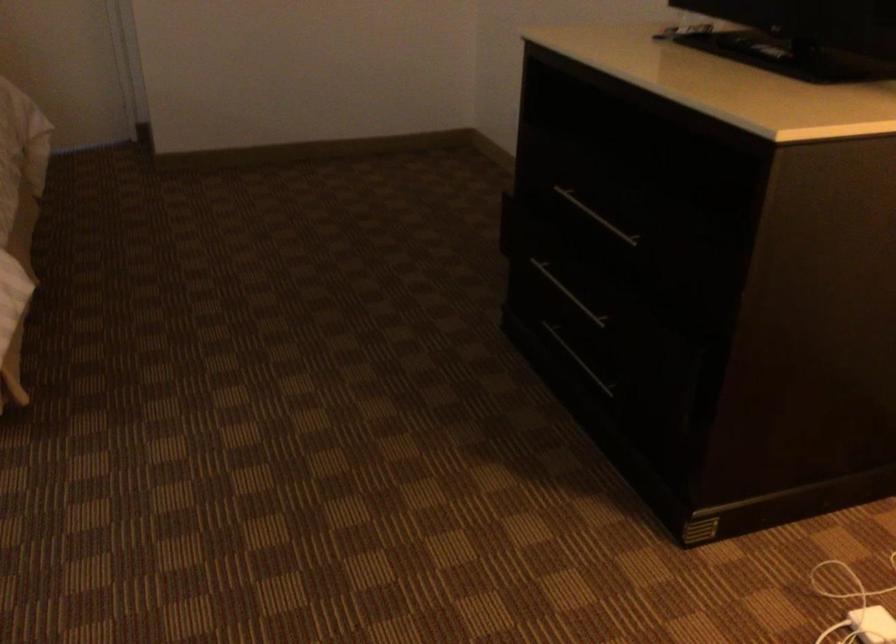
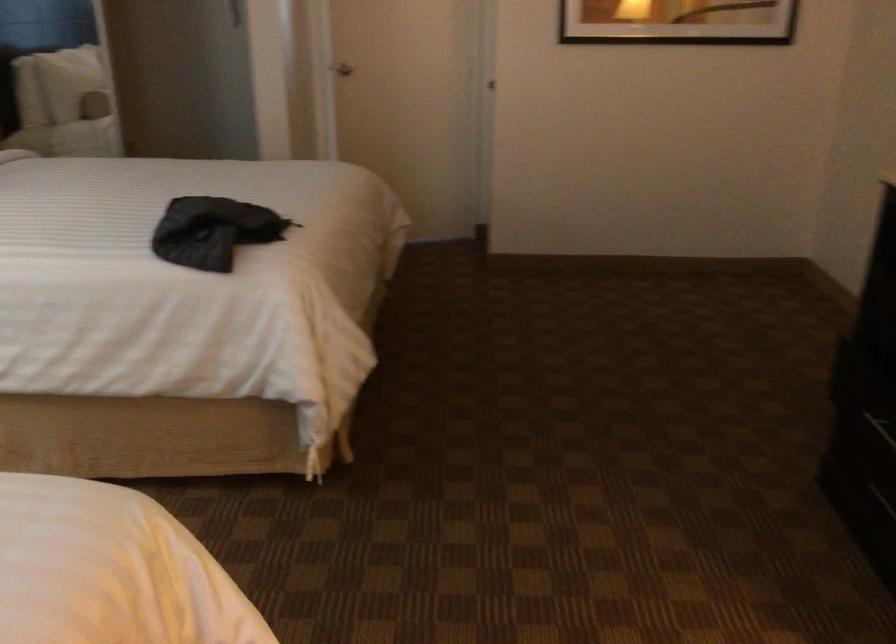
Question: The camera is either moving clockwise (left) or counter-clockwise (right) around the object. The first image is from the beginning of the video and the second image is from the end. Is the camera moving left or right when shooting the video?

Choices:
 (A) Left
 (B) Right

Answer: (B)